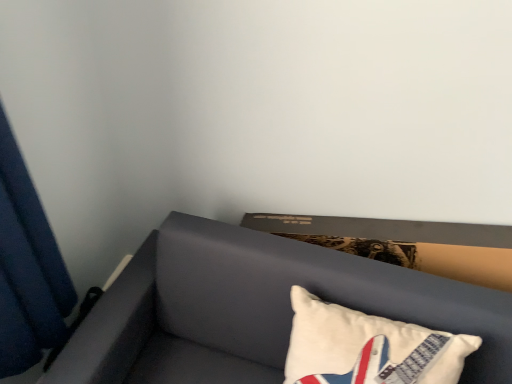
Locate an element on the screen. blue fabric curtain at left is located at coordinates (27, 267).

Measure the distance between point (297, 297) and camera.

They are 39.02 inches apart.

Where is `suede-like gray sofa at lower right`? The image size is (512, 384). suede-like gray sofa at lower right is located at coordinates (269, 301).

This screenshot has height=384, width=512. I want to click on blue fabric curtain at left, so click(x=27, y=267).

Locate an element on the screen. This screenshot has height=384, width=512. curtain located on the left of white cotton pillow at lower right is located at coordinates (27, 267).

Would you say blue fabric curtain at left is a long distance from white cotton pillow at lower right?

Actually, blue fabric curtain at left and white cotton pillow at lower right are a little close together.

Does blue fabric curtain at left have a greater height compared to white cotton pillow at lower right?

Correct, blue fabric curtain at left is much taller as white cotton pillow at lower right.

Consider the image. In terms of width, does blue fabric curtain at left look wider or thinner when compared to white cotton pillow at lower right?

In the image, blue fabric curtain at left appears to be more narrow than white cotton pillow at lower right.

Is white cotton pillow at lower right oriented away from blue fabric curtain at left?

white cotton pillow at lower right does not have its back to blue fabric curtain at left.

Are white cotton pillow at lower right and blue fabric curtain at left located far from each other?

white cotton pillow at lower right is near blue fabric curtain at left, not far away.

Considering the sizes of objects white cotton pillow at lower right and blue fabric curtain at left in the image provided, who is smaller, white cotton pillow at lower right or blue fabric curtain at left?

With smaller size is white cotton pillow at lower right.

Between white cotton pillow at lower right and blue fabric curtain at left, which one has larger width?

white cotton pillow at lower right is wider.

Where is `furniture below the blue fabric curtain at left (from the image's perspective)`? The width and height of the screenshot is (512, 384). furniture below the blue fabric curtain at left (from the image's perspective) is located at coordinates (269, 301).

Are blue fabric curtain at left and suede-like gray sofa at lower right located far from each other?

blue fabric curtain at left is actually quite close to suede-like gray sofa at lower right.

Looking at their sizes, would you say white cotton pillow at lower right is wider or thinner than suede-like gray sofa at lower right?

white cotton pillow at lower right is thinner than suede-like gray sofa at lower right.

This screenshot has width=512, height=384. I want to click on furniture below the white cotton pillow at lower right (from the image's perspective), so click(x=269, y=301).

Is suede-like gray sofa at lower right inside white cotton pillow at lower right?

No, suede-like gray sofa at lower right is not inside white cotton pillow at lower right.

From the image's perspective, would you say white cotton pillow at lower right is positioned over suede-like gray sofa at lower right?

Yes, from the image's perspective, white cotton pillow at lower right is on top of suede-like gray sofa at lower right.

Can you confirm if suede-like gray sofa at lower right is thinner than white cotton pillow at lower right?

Incorrect, the width of suede-like gray sofa at lower right is not less than that of white cotton pillow at lower right.

Is suede-like gray sofa at lower right aimed at white cotton pillow at lower right?

Yes, suede-like gray sofa at lower right is turned towards white cotton pillow at lower right.

From the image's perspective, is suede-like gray sofa at lower right located above or below white cotton pillow at lower right?

Clearly, from the image's perspective, suede-like gray sofa at lower right is below white cotton pillow at lower right.

How much distance is there between suede-like gray sofa at lower right and white cotton pillow at lower right?

suede-like gray sofa at lower right is 7.49 inches from white cotton pillow at lower right.

Between suede-like gray sofa at lower right and blue fabric curtain at left, which one has larger width?

suede-like gray sofa at lower right is wider.

From a real-world perspective, who is located higher, suede-like gray sofa at lower right or blue fabric curtain at left?

blue fabric curtain at left is physically above.

From the image's perspective, which one is positioned higher, suede-like gray sofa at lower right or blue fabric curtain at left?

blue fabric curtain at left is shown above in the image.

Is the depth of suede-like gray sofa at lower right less than that of blue fabric curtain at left?

No, it is behind blue fabric curtain at left.

Find the location of a particular element. This screenshot has width=512, height=384. pillow below the blue fabric curtain at left (from a real-world perspective) is located at coordinates (368, 347).

At what (x,y) coordinates should I click in order to perform the action: click on curtain above the white cotton pillow at lower right (from a real-world perspective). Please return your answer as a coordinate pair (x, y). The image size is (512, 384). Looking at the image, I should click on (27, 267).

When comparing their distances from suede-like gray sofa at lower right, does blue fabric curtain at left or white cotton pillow at lower right seem further?

Among the two, blue fabric curtain at left is located further to suede-like gray sofa at lower right.

When comparing their distances from blue fabric curtain at left, does suede-like gray sofa at lower right or white cotton pillow at lower right seem closer?

suede-like gray sofa at lower right is positioned closer to the anchor blue fabric curtain at left.

Estimate the real-world distances between objects in this image. Which object is further from white cotton pillow at lower right, suede-like gray sofa at lower right or blue fabric curtain at left?

blue fabric curtain at left lies further to white cotton pillow at lower right than the other object.

Based on their spatial positions, is blue fabric curtain at left or suede-like gray sofa at lower right further from white cotton pillow at lower right?

Based on the image, blue fabric curtain at left appears to be further to white cotton pillow at lower right.

In the scene shown: Based on their spatial positions, is white cotton pillow at lower right or blue fabric curtain at left closer to suede-like gray sofa at lower right?

Among the two, white cotton pillow at lower right is located nearer to suede-like gray sofa at lower right.

In the scene shown: Which object lies nearer to the anchor point blue fabric curtain at left, white cotton pillow at lower right or suede-like gray sofa at lower right?

The object closer to blue fabric curtain at left is suede-like gray sofa at lower right.

Where is `furniture between blue fabric curtain at left and white cotton pillow at lower right from left to right`? furniture between blue fabric curtain at left and white cotton pillow at lower right from left to right is located at coordinates (269, 301).